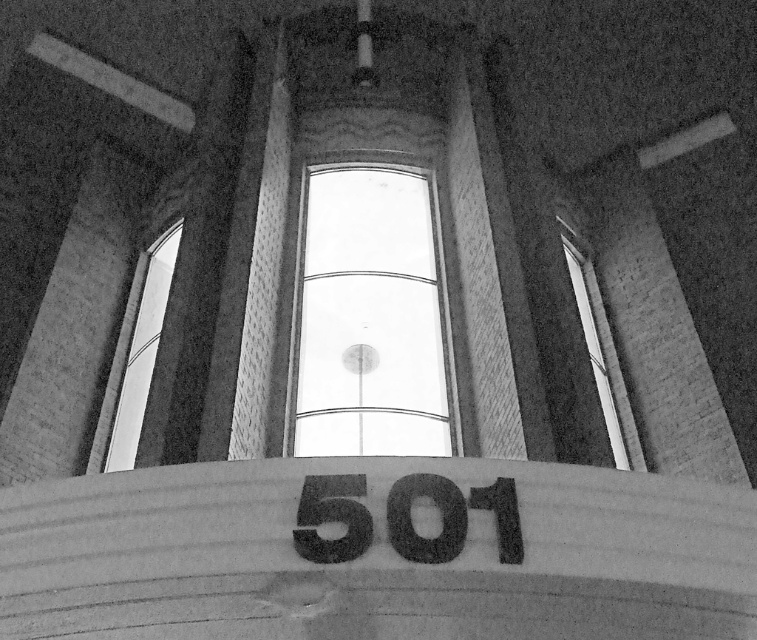
Looking at this image, you are standing at the base of the building depicted in the image. You notice two transparent glass windows, the transparent glass window at center and the transparent glass window at left. Which window appears closer to you from your current viewpoint?

The transparent glass window at center appears closer because it is in front of the transparent glass window at left.